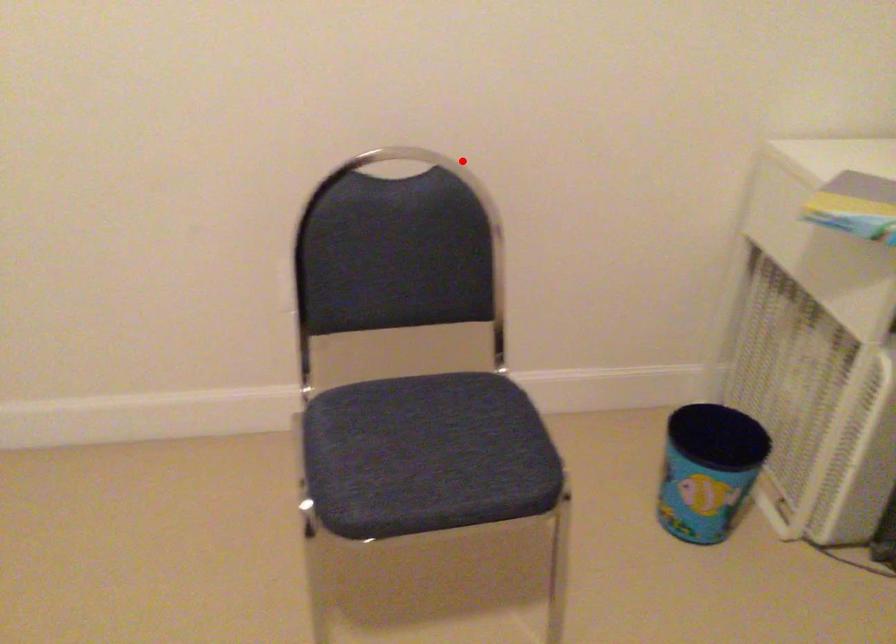
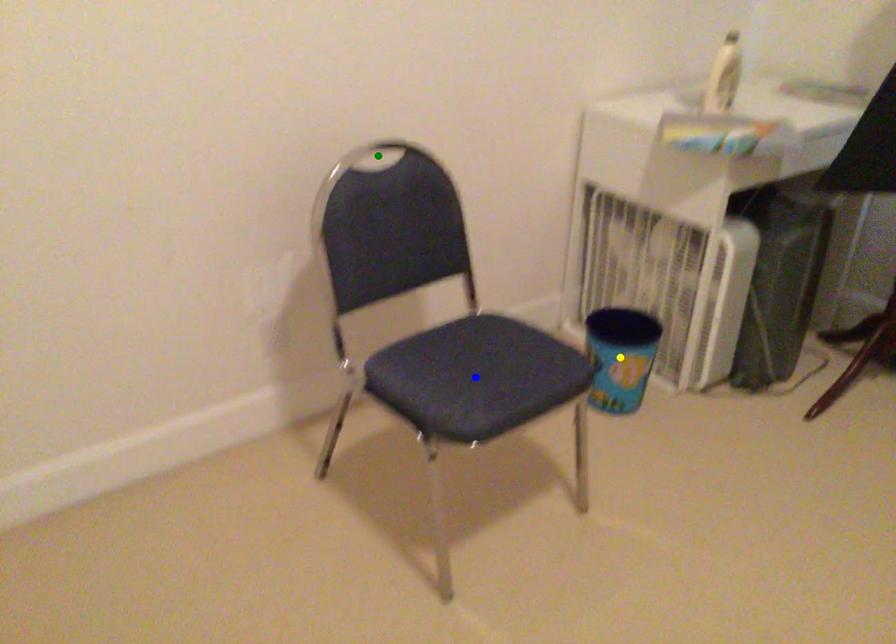
Question: I am providing you with two images of the same scene from different viewpoints. A red point is marked on the first image. You are given multiple points on the second image. Which point in image 2 represents the same 3d spot as the red point in image 1?

Choices:
 (A) blue point
 (B) yellow point
 (C) green point

Answer: (C)